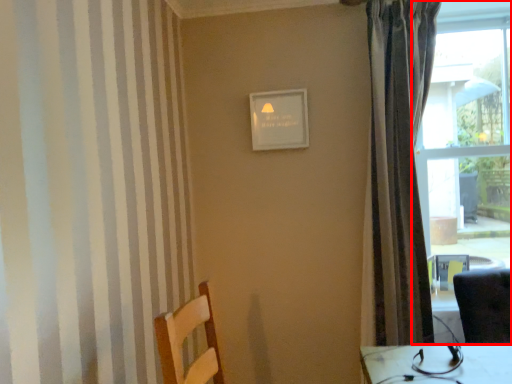
Question: Considering the relative positions of window (annotated by the red box) and curtain in the image provided, where is window (annotated by the red box) located with respect to the staircase?

Choices:
 (A) left
 (B) right

Answer: (B)